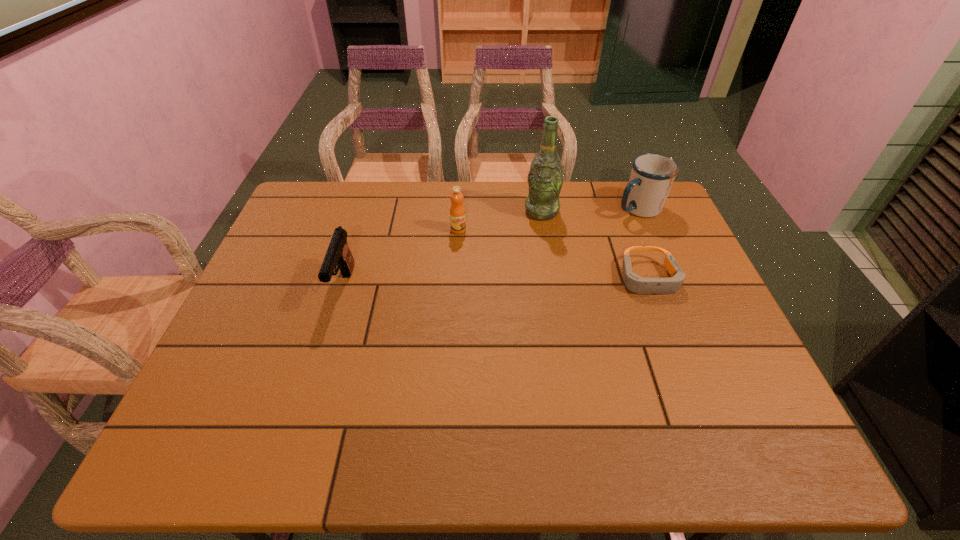
This screenshot has height=540, width=960. Find the location of `free location at the far right corner of the desktop`. free location at the far right corner of the desktop is located at coordinates point(619,182).

Identify the location of empty space that is in between the mug and the shortest object. This screenshot has height=540, width=960. (643, 243).

Where is `vacant space that is in between the mug and the tallest object`? The image size is (960, 540). vacant space that is in between the mug and the tallest object is located at coordinates (590, 210).

Identify the location of vacant space that's between the beer bottle and the shortest object. The height and width of the screenshot is (540, 960). (595, 245).

At what (x,y) coordinates should I click in order to perform the action: click on vacant region between the leftmost object and the mug. Please return your answer as a coordinate pair (x, y). Looking at the image, I should click on (491, 247).

Locate an element on the screen. vacant area between the fourth object from right to left and the goggles is located at coordinates (553, 254).

Where is `free space between the pistol and the goggles`? free space between the pistol and the goggles is located at coordinates (496, 282).

The image size is (960, 540). What are the coordinates of `free space between the third object from left to right and the second object from left to right` in the screenshot? It's located at (500, 220).

Find the location of a particular element. The height and width of the screenshot is (540, 960). vacant region between the tallest object and the pistol is located at coordinates (443, 249).

Find the location of a particular element. vacant area that lies between the mug and the pistol is located at coordinates (491, 247).